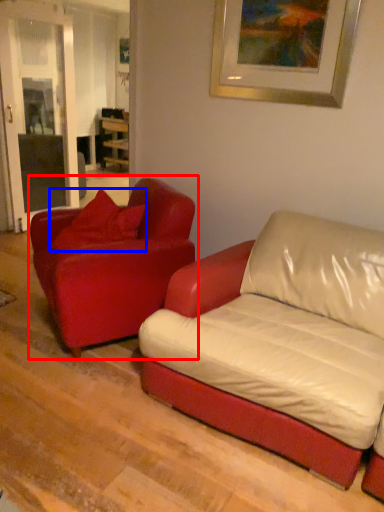
Question: Among these objects, which one is farthest to the camera, studio couch (highlighted by a red box) or pillow (highlighted by a blue box)?

Choices:
 (A) studio couch
 (B) pillow

Answer: (B)